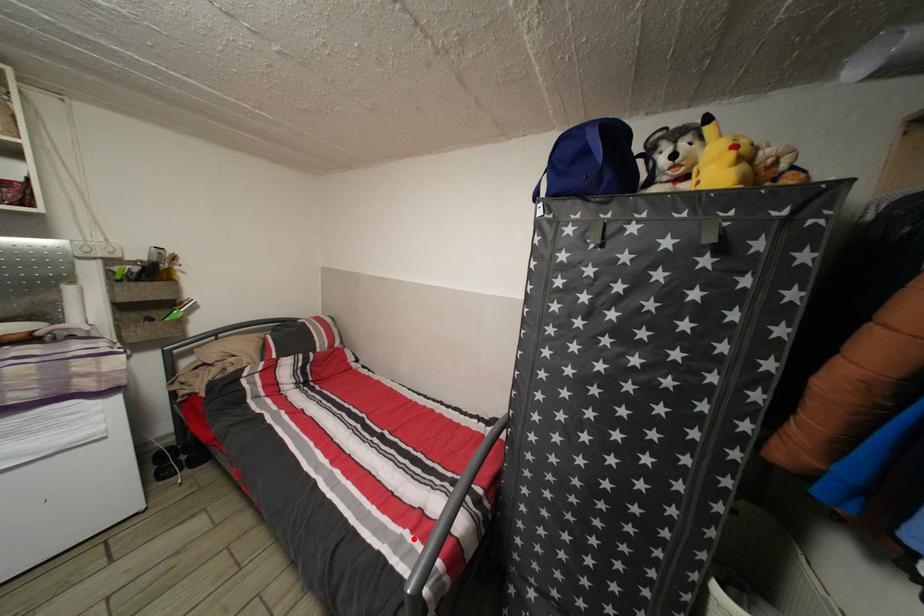
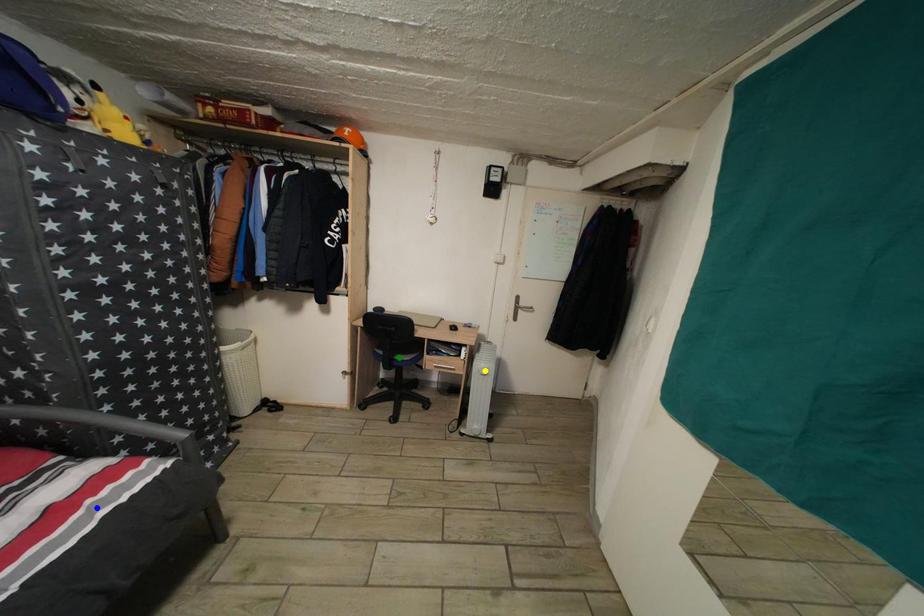
Question: I am providing you with two images of the same scene from different viewpoints. A red point is marked on the first image. You are given multiple points on the second image. Which mark in image 2 goes with the point in image 1?

Choices:
 (A) blue point
 (B) yellow point
 (C) green point

Answer: (A)